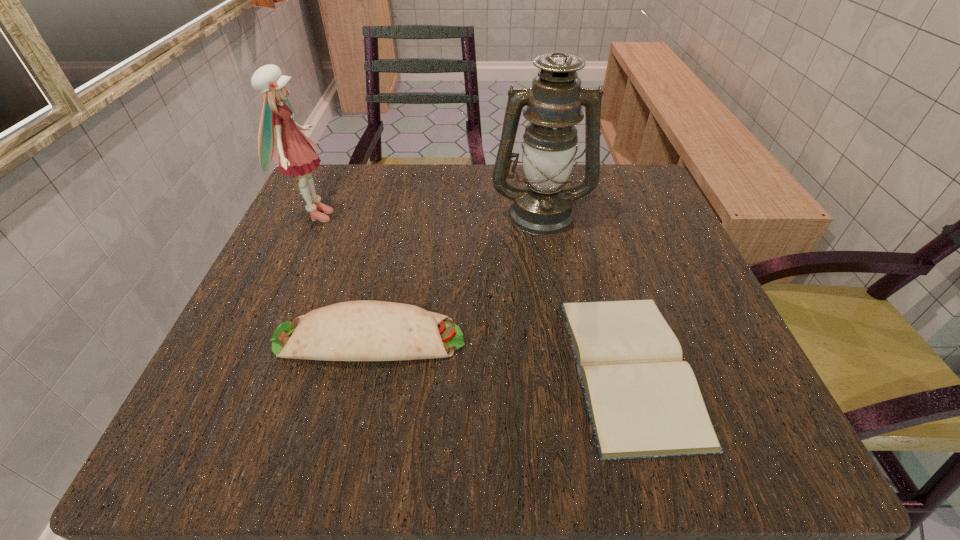
You are a GUI agent. You are given a task and a screenshot of the screen. Output one action in this format:
    pyautogui.click(x=<x>, y=<y>)
    Task: Click on the oil lamp
    The image size is (960, 540).
    Given the screenshot: What is the action you would take?
    pyautogui.click(x=542, y=206)

Where is `doll`? This screenshot has height=540, width=960. doll is located at coordinates (294, 152).

Identify the location of the third tallest object. (365, 330).

Identify the location of the shortest object. (643, 400).

Find the location of a particular element. The height and width of the screenshot is (540, 960). free region located on the left of the oil lamp is located at coordinates (444, 213).

Locate an element on the screen. The height and width of the screenshot is (540, 960). vacant region located 0.380m on the front-facing side of the doll is located at coordinates (521, 216).

You are a GUI agent. You are given a task and a screenshot of the screen. Output one action in this format:
    pyautogui.click(x=<x>, y=<y>)
    Task: Click on the free spot located at the bitten end of the burrito
    
    Given the screenshot: What is the action you would take?
    pyautogui.click(x=550, y=338)

Identify the location of free location located 0.270m on the back of the Bible. This screenshot has width=960, height=540. click(584, 206).

Identify the location of oil lamp at the far edge. (542, 206).

Locate an element on the screen. doll present at the far edge is located at coordinates (294, 152).